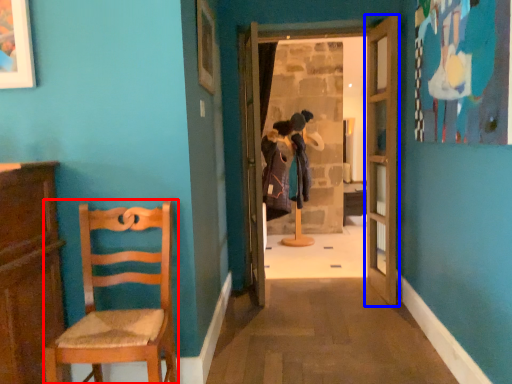
Question: Which object appears farthest to the camera in this image, chair (highlighted by a red box) or door (highlighted by a blue box)?

Choices:
 (A) chair
 (B) door

Answer: (B)